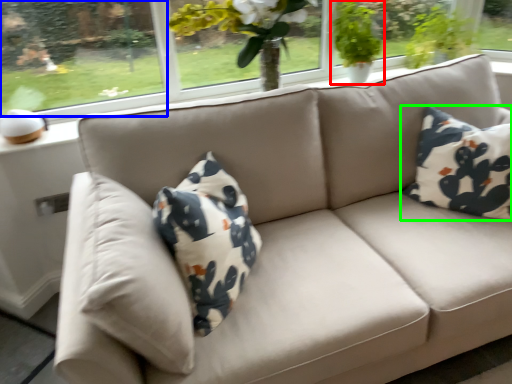
Question: Which object is positioned closest to houseplant (highlighted by a red box)? Select from window screen (highlighted by a blue box) and pillow (highlighted by a green box).

Choices:
 (A) window screen
 (B) pillow

Answer: (B)